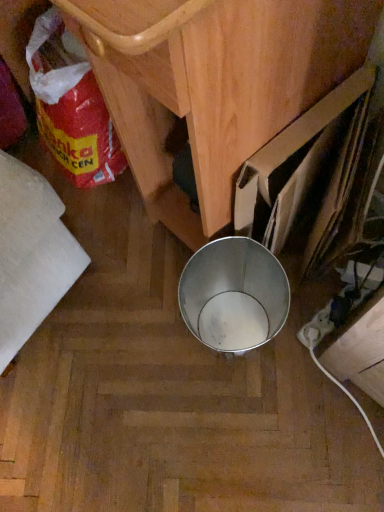
The image size is (384, 512). In order to click on vacant space in front of red plastic bag at lower left in this screenshot , I will do `click(109, 217)`.